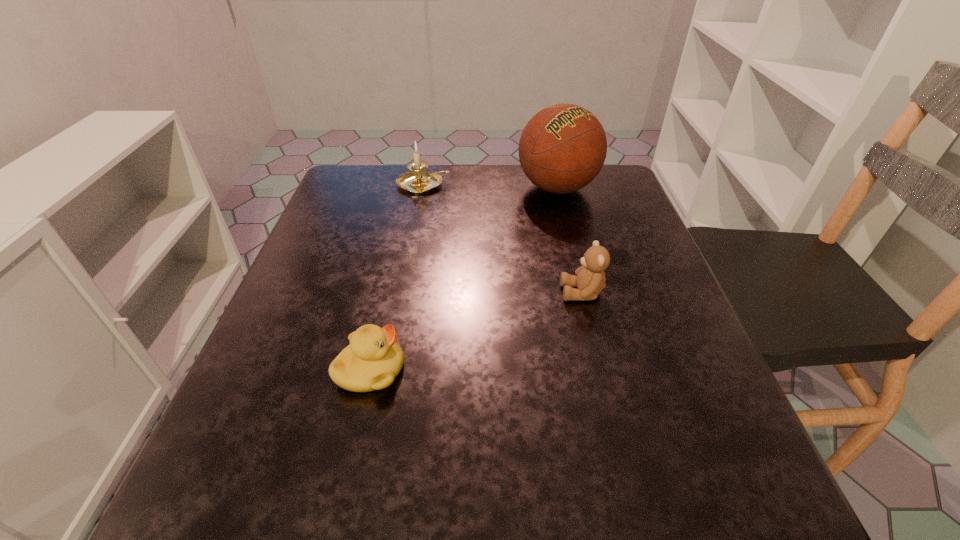
The height and width of the screenshot is (540, 960). I want to click on free region located on the beak of the shortest object, so click(x=496, y=370).

Find the location of `basketball located at the far edge`. basketball located at the far edge is located at coordinates (563, 147).

Identify the location of candle holder that is at the far edge. (415, 182).

Locate an element on the screen. The image size is (960, 540). candle holder situated at the left edge is located at coordinates (415, 182).

At what (x,y) coordinates should I click in order to perform the action: click on duckling located in the left edge section of the desktop. Please return your answer as a coordinate pair (x, y). The height and width of the screenshot is (540, 960). Looking at the image, I should click on (372, 360).

The width and height of the screenshot is (960, 540). Identify the location of basketball located at the right edge. (563, 147).

Image resolution: width=960 pixels, height=540 pixels. In order to click on teddy bear located at the right edge in this screenshot , I will do `click(590, 280)`.

Find the location of a particular element. object located in the far left corner section of the desktop is located at coordinates (415, 182).

Where is `object located at the far right corner`? Image resolution: width=960 pixels, height=540 pixels. object located at the far right corner is located at coordinates (563, 147).

This screenshot has width=960, height=540. Identify the location of free space at the far edge. (524, 208).